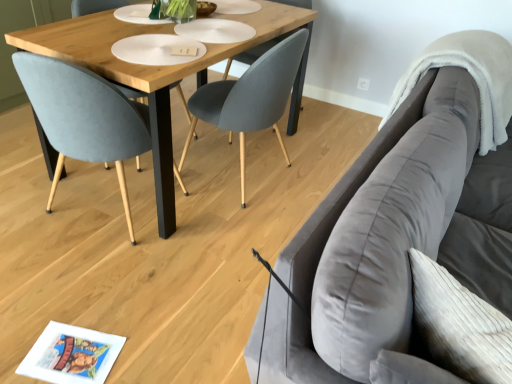
I want to click on vacant point to the right of matte gray chair at center, the 1th chair in the right-to-left sequence, so click(x=318, y=172).